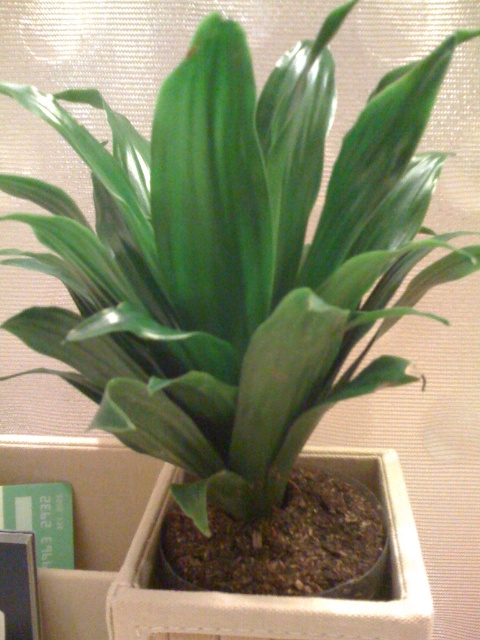
Question: Does matte white pot at center have a lesser width compared to green cardboard box at lower left?

Choices:
 (A) no
 (B) yes

Answer: (A)

Question: Which point is farther to the camera?

Choices:
 (A) matte white pot at center
 (B) green cardboard box at lower left

Answer: (B)

Question: Is matte white pot at center thinner than green cardboard box at lower left?

Choices:
 (A) no
 (B) yes

Answer: (A)

Question: Can you confirm if matte white pot at center is positioned below green cardboard box at lower left?

Choices:
 (A) no
 (B) yes

Answer: (A)